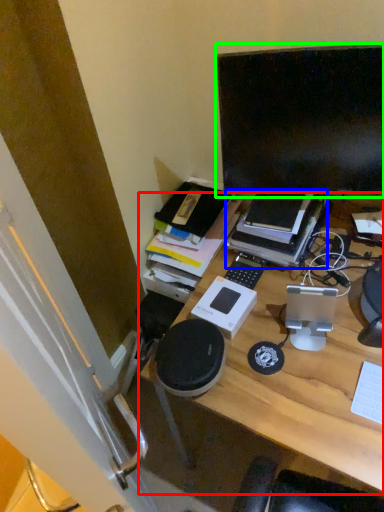
Question: Estimate the real-world distances between objects in this image. Which object is farther from desk (highlighted by a red box), book (highlighted by a blue box) or computer monitor (highlighted by a green box)?

Choices:
 (A) book
 (B) computer monitor

Answer: (B)